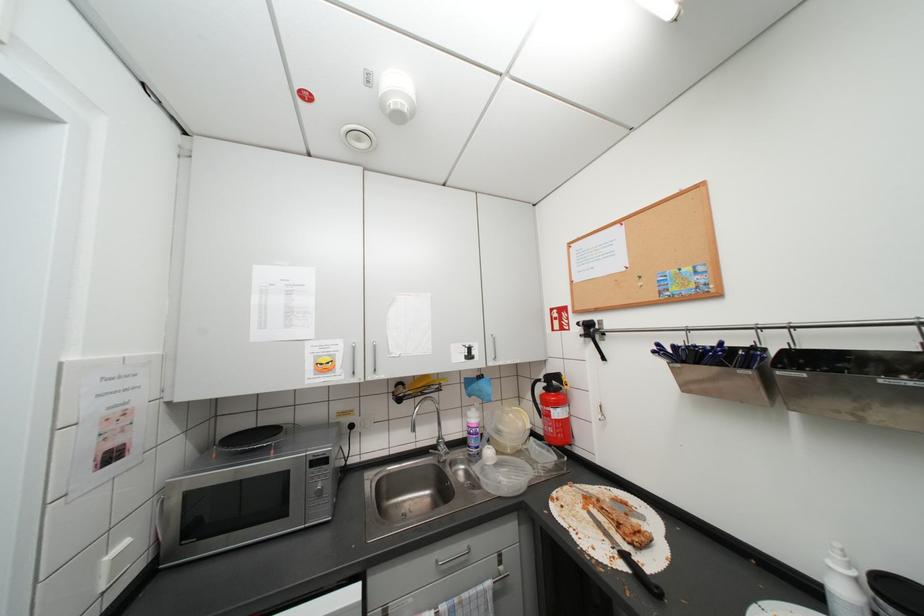
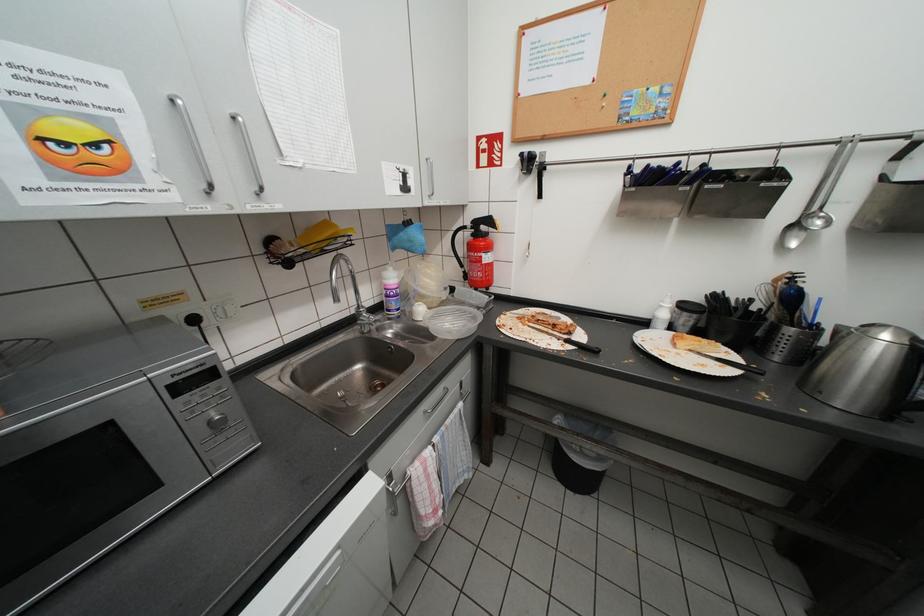
How did the camera likely rotate?

The camera's rotation is toward right-down.